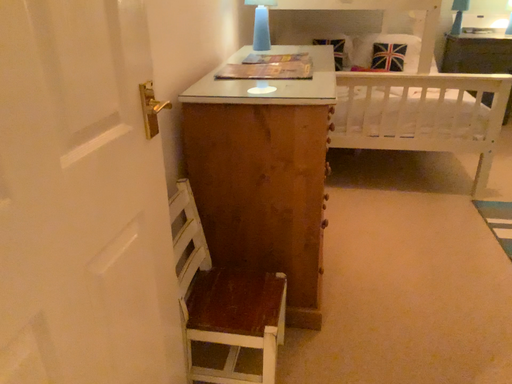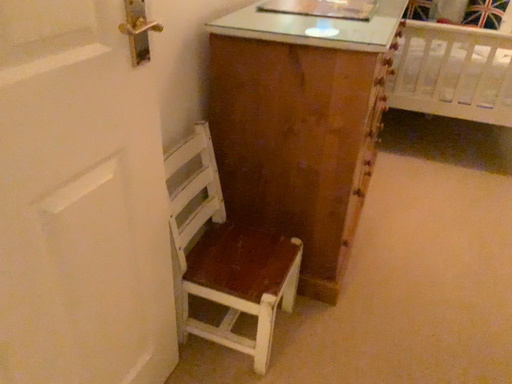
Question: Which way did the camera rotate in the video?

Choices:
 (A) rotated left
 (B) rotated right

Answer: (A)